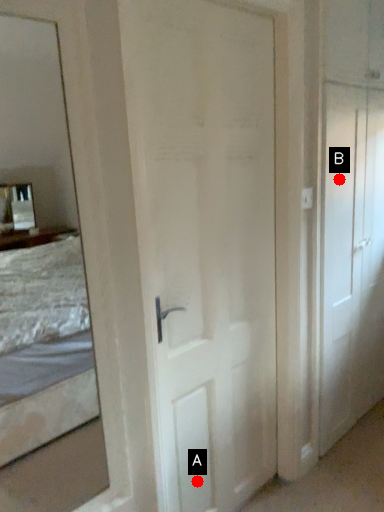
Question: Two points are circled on the image, labeled by A and B beside each circle. Which point appears closest to the camera in this image?

Choices:
 (A) A is closer
 (B) B is closer

Answer: (A)